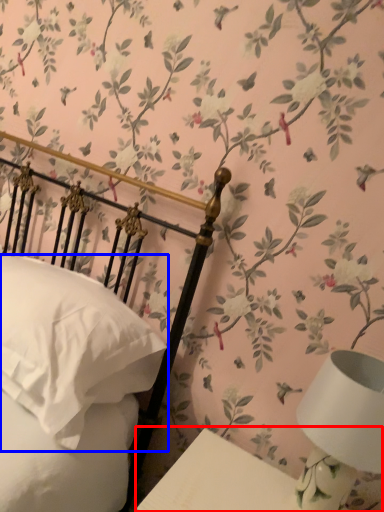
Question: Which point is further to the camera, table (highlighted by a red box) or pillow (highlighted by a blue box)?

Choices:
 (A) table
 (B) pillow

Answer: (B)